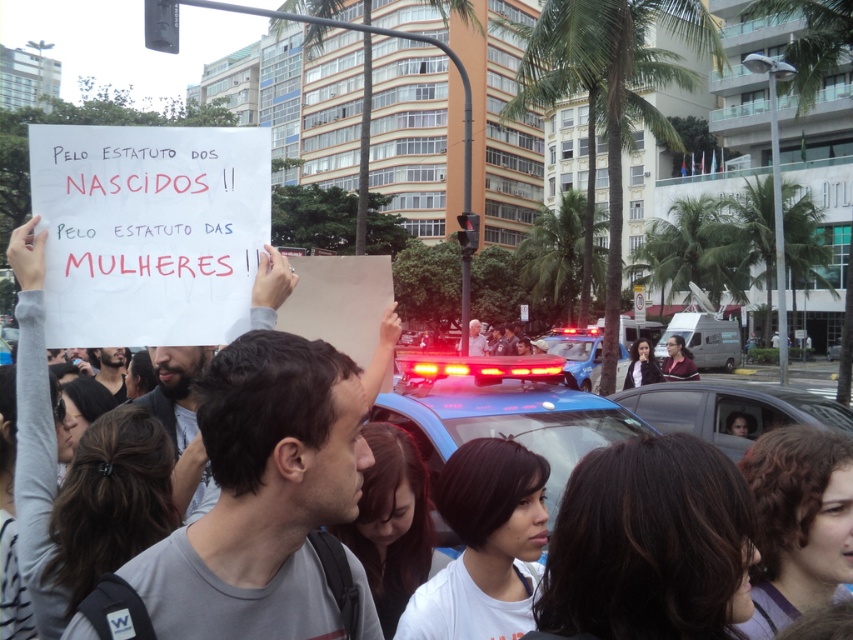
You are a photographer standing at the edge of the protest area. You want to capture a photo that includes both the gray cotton shirt at center and the palm trees in the background. Based on their positions, will the palm trees be visible in the background of the shirt?

The gray cotton shirt at center is positioned at point (263,496). Since palm trees are part of the background cityscape described in the scene, they would be visible behind the shirt in the photo.

From the picture: You are a photographer at the demonstration and want to capture both the gray cotton shirt at center and the black matte shirt at center in the same frame. Which shirt should you focus on first to ensure both are in the shot?

The gray cotton shirt at center is positioned on the right side of black matte shirt at center, so you should focus on the black matte shirt at center first to ensure both are in the shot.

You are a photographer trying to capture a clear image of both the gray cotton shirt at center and the black matte shirt at center. Since the shirts are positioned close to each other, which one should you focus on first to ensure both are in frame without overlapping?

The gray cotton shirt at center is wider than the black matte shirt at center, so you should focus on the gray cotton shirt at center first to accommodate its larger size and ensure both shirts remain in frame without overlapping.